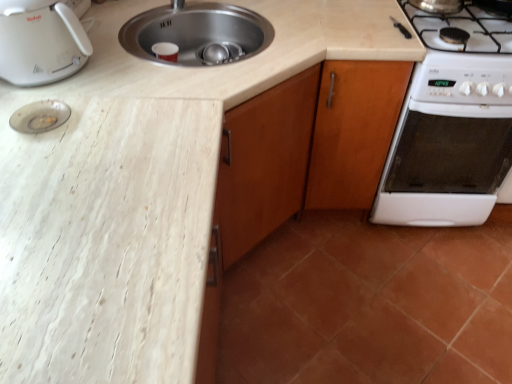
Question: Would you say terracotta tile at lower right is to the left or to the right of transparent glass plate at upper left in the picture?

Choices:
 (A) left
 (B) right

Answer: (B)

Question: Choose the correct answer: Is terracotta tile at lower right inside transparent glass plate at upper left or outside it?

Choices:
 (A) inside
 (B) outside

Answer: (B)

Question: Estimate the real-world distances between objects in this image. Which object is farther from the terracotta tile at lower right?

Choices:
 (A) white plastic toaster at upper left
 (B) white glossy oven at right
 (C) wooden cabinet at right
 (D) transparent glass plate at upper left
 (E) white marble countertop at left

Answer: (D)

Question: Estimate the real-world distances between objects in this image. Which object is farther from the white marble countertop at left?

Choices:
 (A) white glossy oven at right
 (B) terracotta tile at lower right
 (C) white plastic toaster at upper left
 (D) transparent glass plate at upper left
 (E) wooden cabinet at right

Answer: (A)